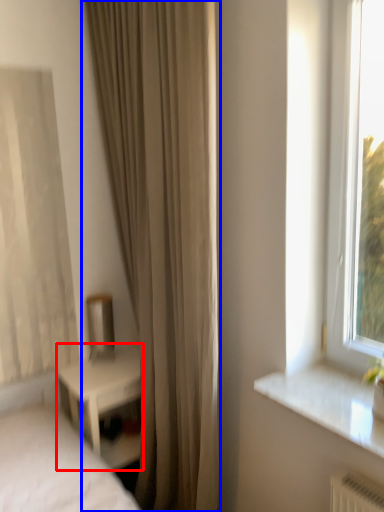
Question: Which object is closer to the camera taking this photo, nightstand (highlighted by a red box) or curtain (highlighted by a blue box)?

Choices:
 (A) nightstand
 (B) curtain

Answer: (B)